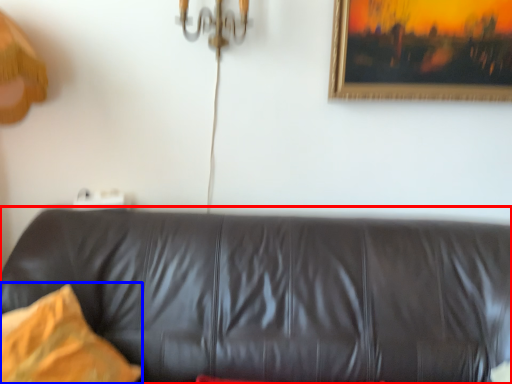
Question: Which of the following is the closest to the observer, studio couch (highlighted by a red box) or pillow (highlighted by a blue box)?

Choices:
 (A) studio couch
 (B) pillow

Answer: (A)